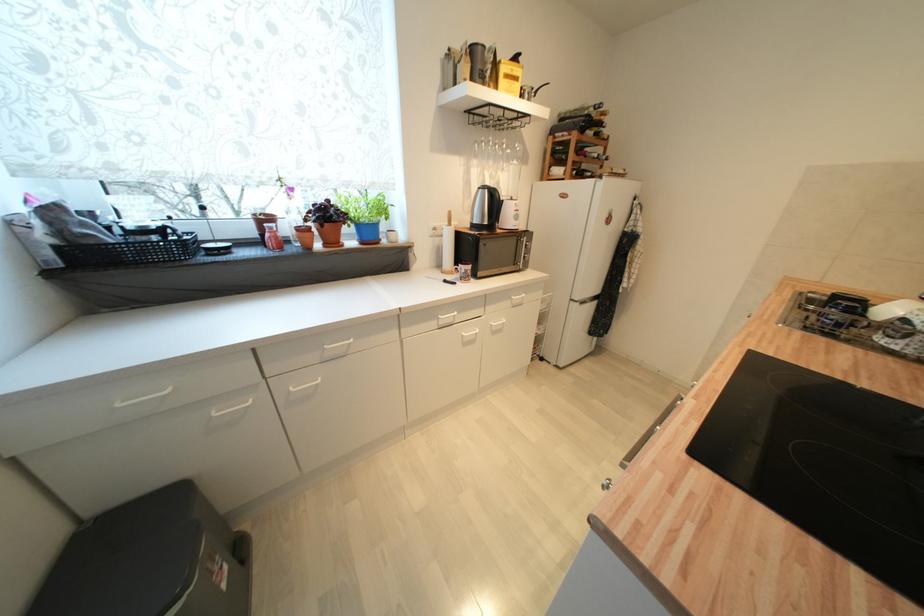
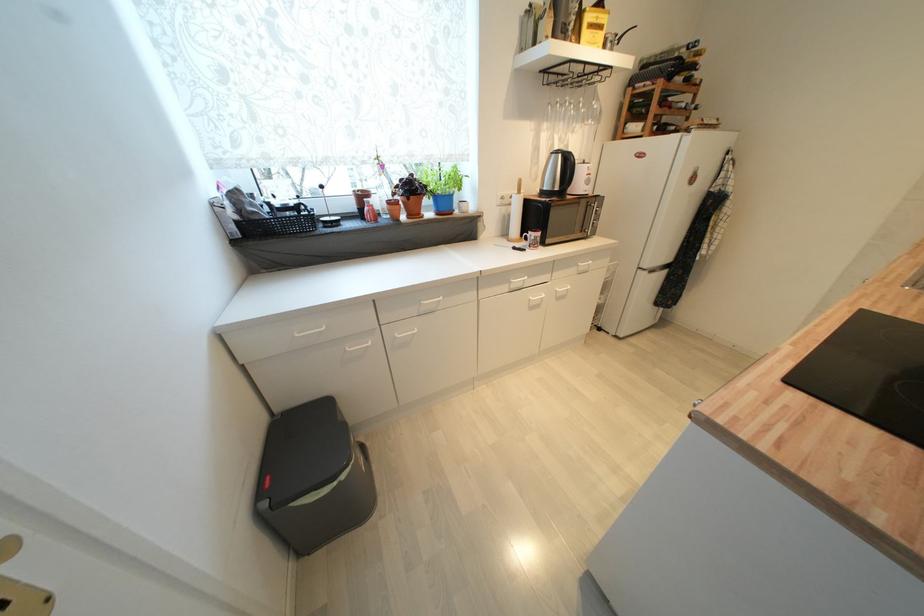
Where in the second image is the point corresponding to the point at 444,321 from the first image?

(516, 284)